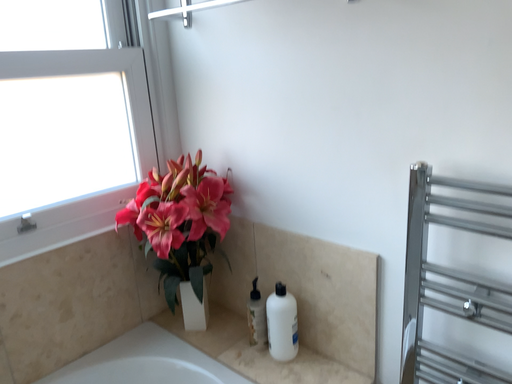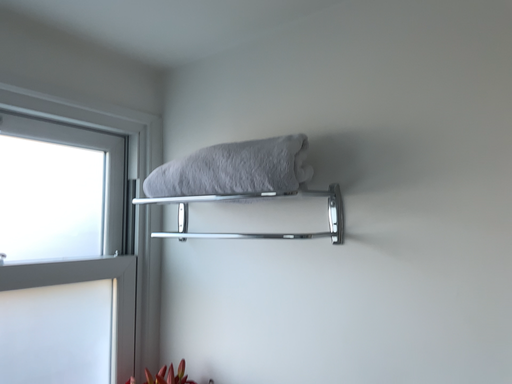
Question: How did the camera likely rotate when shooting the video?

Choices:
 (A) rotated upward
 (B) rotated downward

Answer: (A)